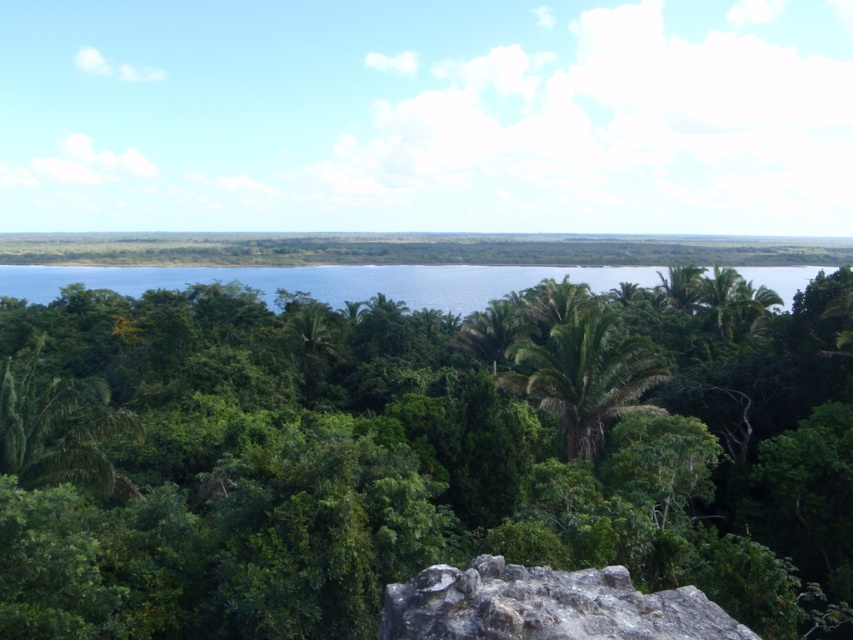
You are an environmental scientist assessing the biodiversity of the tropical landscape. You observe the green leafy tree at center and the green leafy palm tree at center. Which tree has a larger canopy area?

The green leafy tree at center has a larger canopy area than the green leafy palm tree at center.

You are a hiker standing at the base of the gray rough rock at lower center and want to reach the green leafy tree at center. Which direction should you walk to get closer to the tree?

Since the green leafy tree at center is taller than the gray rough rock at lower center, you should walk forward towards the center of the scene to reach the tree.